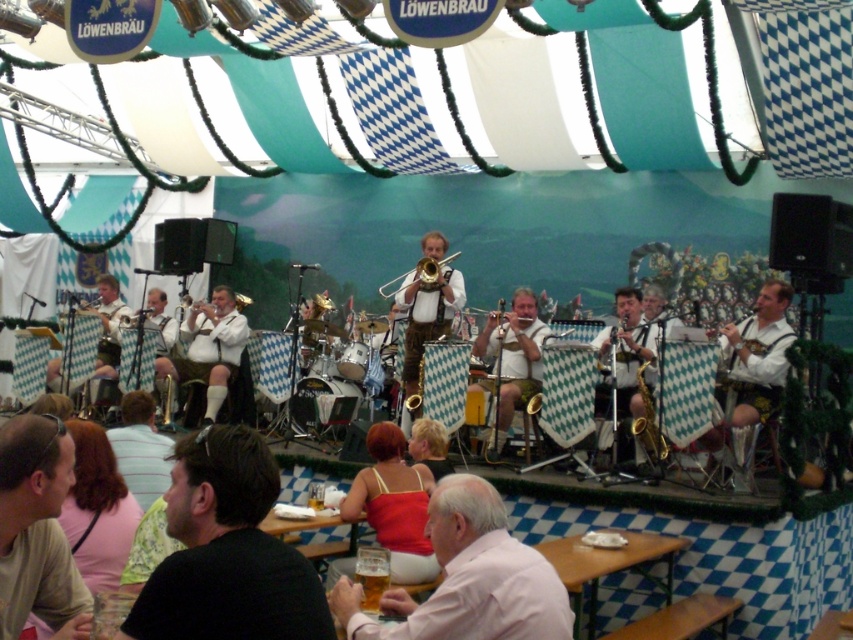
Question: Which object is positioned closest to the white leather pants at center?

Choices:
 (A) black shirt at lower left
 (B) pink fabric shirt at lower center
 (C) white leather shirt at right

Answer: (C)

Question: Which point appears farthest from the camera in this image?

Choices:
 (A) (1, 448)
 (B) (431, 289)
 (C) (384, 566)

Answer: (B)

Question: Observing the image, what is the correct spatial positioning of white leather jacket at center in reference to gold brass trombone at center?

Choices:
 (A) below
 (B) above

Answer: (A)

Question: Which is nearer to the translucent glass mug at lower center?

Choices:
 (A) black shirt at lower left
 (B) light brown t-shirt at lower left
 (C) gold brass trombone at center

Answer: (A)

Question: Does light blue shirt at lower left appear on the left side of translucent glass mug at lower center?

Choices:
 (A) yes
 (B) no

Answer: (A)

Question: Can you confirm if white leather pants at center is thinner than white leather jacket at center?

Choices:
 (A) yes
 (B) no

Answer: (B)